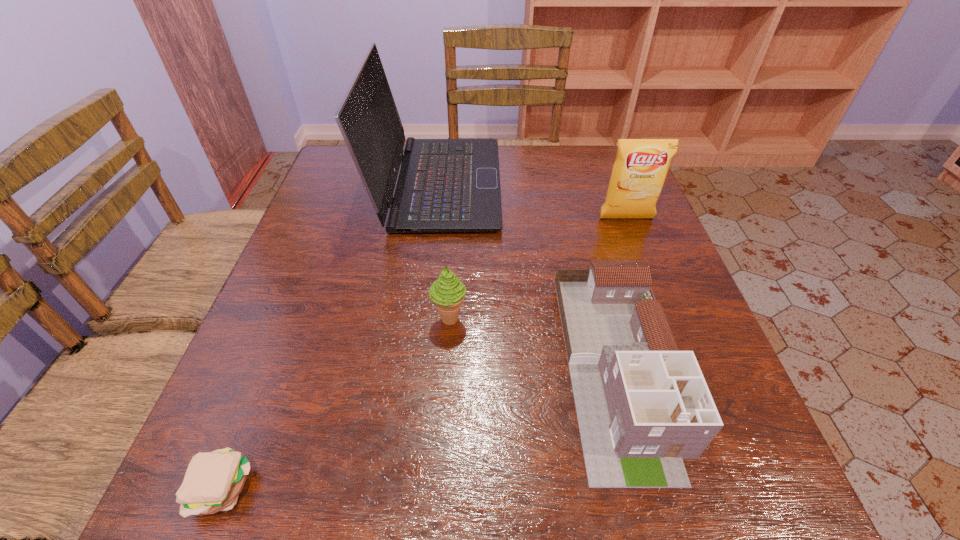
In order to click on the tallest object in this screenshot , I will do `click(444, 185)`.

Where is `crisp (potato chip)`? crisp (potato chip) is located at coordinates (641, 166).

The image size is (960, 540). Identify the location of icecream. (448, 292).

The image size is (960, 540). In order to click on dollhouse in this screenshot , I will do `click(643, 406)`.

At what (x,y) coordinates should I click in order to perform the action: click on the leftmost object. Please return your answer as a coordinate pair (x, y). The height and width of the screenshot is (540, 960). Looking at the image, I should click on (213, 481).

Where is `patty`? patty is located at coordinates (213, 481).

Find the location of a particular element. Image resolution: width=960 pixels, height=540 pixels. blank space located on the screen of the tallest object is located at coordinates pyautogui.click(x=600, y=185).

Where is `free spot located 0.210m on the front of the crisp (potato chip) with the logo`? free spot located 0.210m on the front of the crisp (potato chip) with the logo is located at coordinates (653, 287).

At what (x,y) coordinates should I click in order to perform the action: click on free space located 0.250m on the front of the icecream. Please return your answer as a coordinate pair (x, y). Looking at the image, I should click on (441, 466).

Identify the location of free location located 0.090m on the back of the patty. Image resolution: width=960 pixels, height=540 pixels. (256, 401).